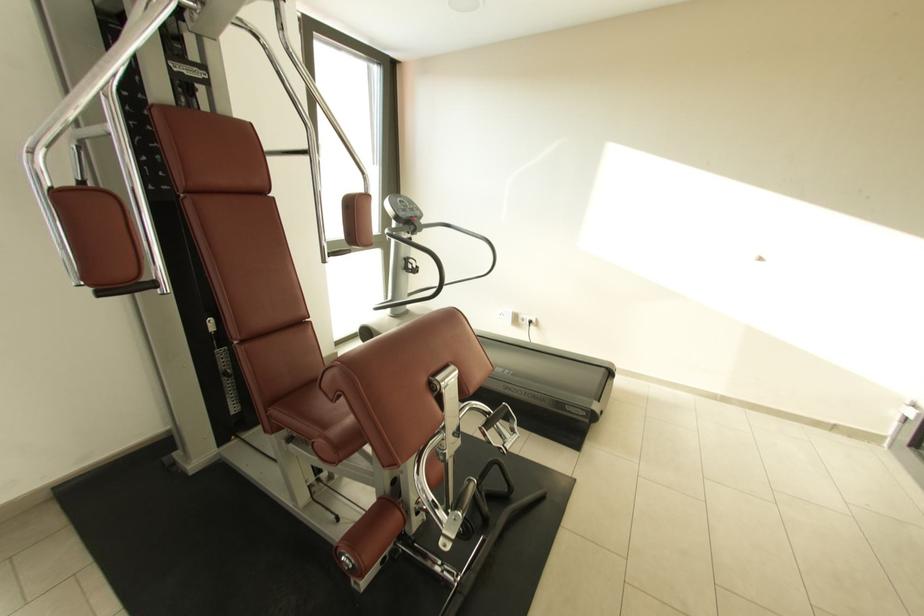
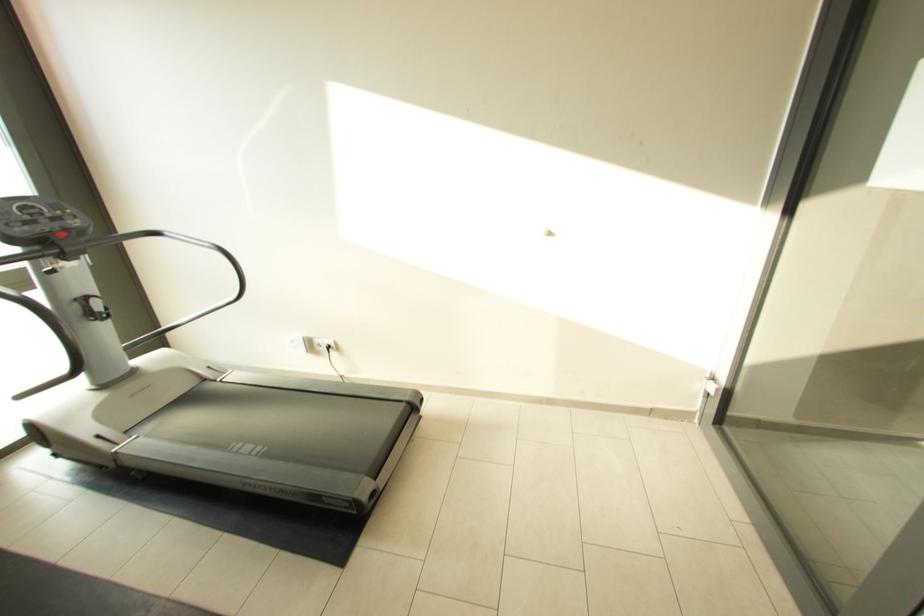
Find the pixel in the second image that matches [526,317] in the first image.

(322, 342)